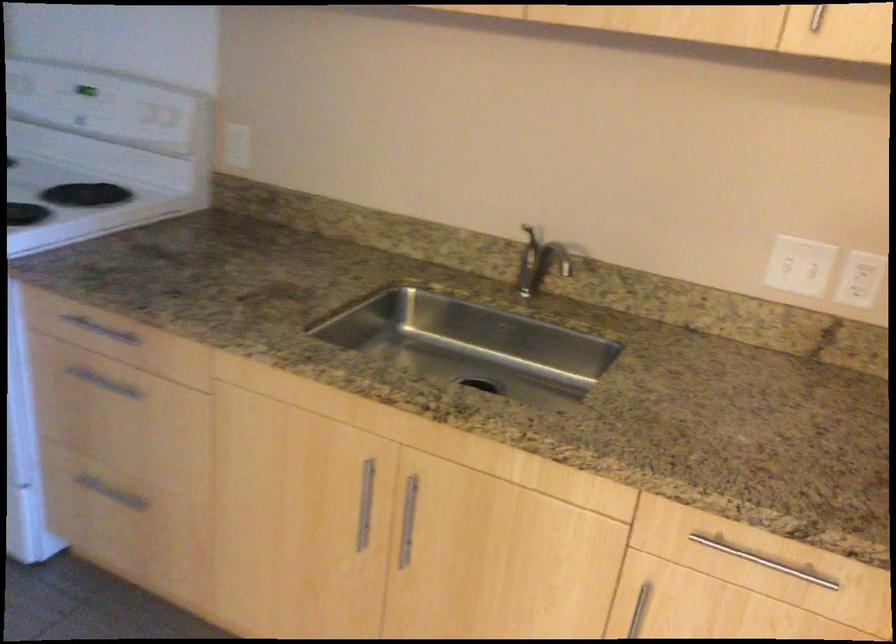
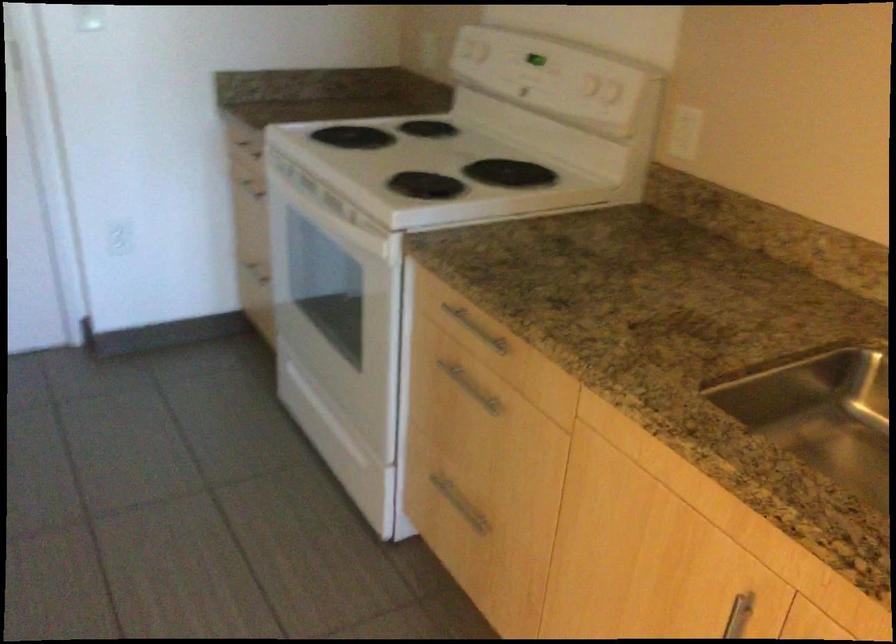
Question: The camera is either moving clockwise (left) or counter-clockwise (right) around the object. The first image is from the beginning of the video and the second image is from the end. Is the camera moving left or right when shooting the video?

Choices:
 (A) Left
 (B) Right

Answer: (B)